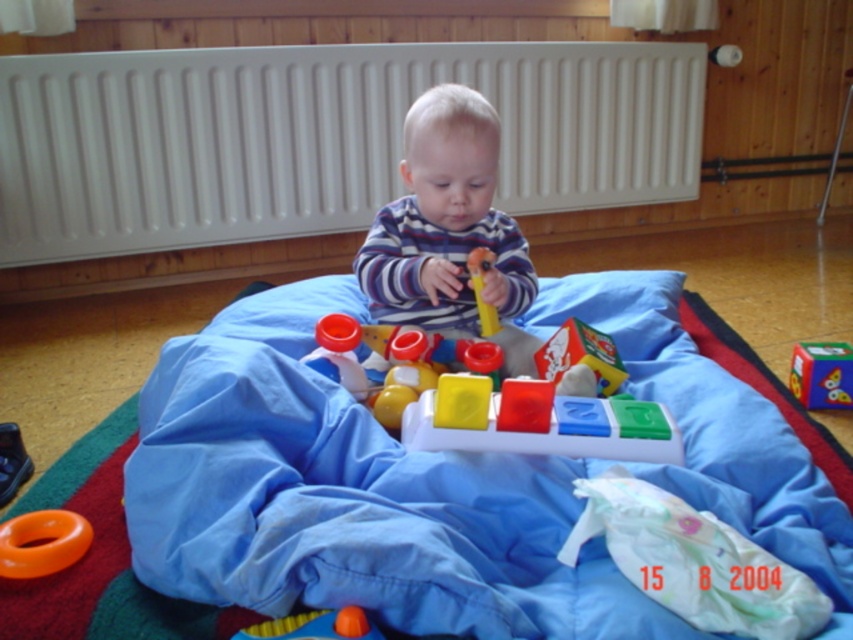
Does point (820, 372) come farther from viewer compared to point (351, 612)?

Yes, point (820, 372) is farther from viewer.

Which is in front, point (830, 378) or point (369, 636)?

Point (369, 636) is more forward.

Locate an element on the screen. The image size is (853, 640). multicolored plastic cube at center is located at coordinates (821, 374).

Can you confirm if blue fabric blanket at center is shorter than orange rubber ring at lower left?

Incorrect, blue fabric blanket at center's height does not fall short of orange rubber ring at lower left's.

Which is behind, point (643, 396) or point (84, 518)?

The point (643, 396) is more distant.

You are a GUI agent. You are given a task and a screenshot of the screen. Output one action in this format:
    pyautogui.click(x=<x>, y=<y>)
    Task: Click on the blue fabric blanket at center
    This screenshot has width=853, height=640.
    Given the screenshot: What is the action you would take?
    pyautogui.click(x=349, y=497)

Which is behind, point (384, 420) or point (21, 561)?

Point (384, 420)

Is point (408, 420) farther from camera compared to point (16, 573)?

Yes, it is.

Which is in front, point (389, 337) or point (21, 544)?

Point (21, 544) is in front.

Where is `plastic colorful blocks at center`? The height and width of the screenshot is (640, 853). plastic colorful blocks at center is located at coordinates (494, 397).